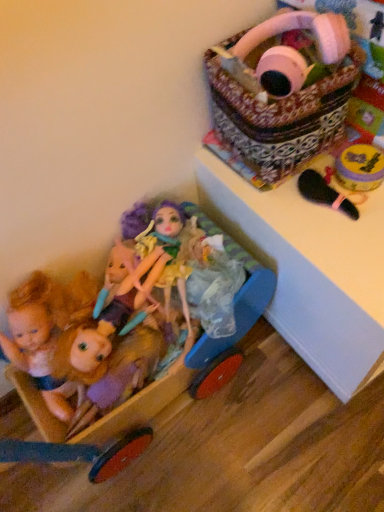
Question: Can you confirm if patterned fabric basket at upper right is positioned to the right of wooden baby carriage at lower left?

Choices:
 (A) no
 (B) yes

Answer: (B)

Question: Is patterned fabric basket at upper right oriented away from wooden baby carriage at lower left?

Choices:
 (A) no
 (B) yes

Answer: (A)

Question: Does patterned fabric basket at upper right lie in front of wooden baby carriage at lower left?

Choices:
 (A) yes
 (B) no

Answer: (B)

Question: Is wooden baby carriage at lower left completely or partially inside patterned fabric basket at upper right?

Choices:
 (A) yes
 (B) no

Answer: (B)

Question: Can you confirm if patterned fabric basket at upper right is taller than wooden baby carriage at lower left?

Choices:
 (A) yes
 (B) no

Answer: (B)

Question: Is the surface of patterned fabric basket at upper right in direct contact with wooden baby carriage at lower left?

Choices:
 (A) yes
 (B) no

Answer: (B)

Question: Does white glossy changing table at upper right appear on the right side of wooden baby carriage at lower left?

Choices:
 (A) no
 (B) yes

Answer: (B)

Question: Can you confirm if white glossy changing table at upper right is bigger than wooden baby carriage at lower left?

Choices:
 (A) no
 (B) yes

Answer: (A)

Question: Is white glossy changing table at upper right facing towards wooden baby carriage at lower left?

Choices:
 (A) no
 (B) yes

Answer: (A)

Question: From the image's perspective, is white glossy changing table at upper right on top of wooden baby carriage at lower left?

Choices:
 (A) no
 (B) yes

Answer: (B)

Question: Does white glossy changing table at upper right lie behind wooden baby carriage at lower left?

Choices:
 (A) no
 (B) yes

Answer: (B)

Question: Is white glossy changing table at upper right oriented away from wooden baby carriage at lower left?

Choices:
 (A) yes
 (B) no

Answer: (B)

Question: From the image's perspective, is pastel purple fabric doll at lower left, placed as the 2th doll when sorted from left to right, located beneath shiny purple hair at center, the 1th doll when ordered from right to left?

Choices:
 (A) yes
 (B) no

Answer: (A)